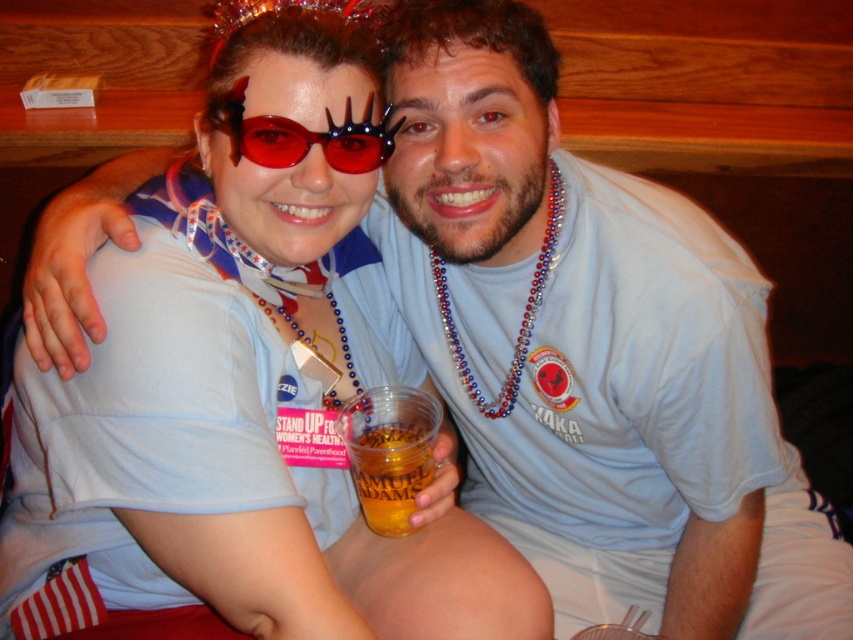
You are at a party and need to choose between the red plastic goggles at center and the translucent plastic cup at lower center to place on your head. Which one is more suitable based on their height?

The red plastic goggles at center has a lesser height compared to the translucent plastic cup at lower center, so the red plastic goggles at center would be more suitable to place on your head since it is shorter and less likely to obstruct your vision.

You are a bartender at a party. You need to serve a drink to the person wearing the red plastic goggles at center. Where should you place the drink relative to the translucent plastic cup at lower center?

The red plastic goggles at center is in front of the translucent plastic cup at lower center, so you should place the drink behind the translucent plastic cup at lower center so it is visible to the person wearing the goggles.

You are a photographer standing at the camera position. You want to take a closeup photo of the point at coordinates point (280, 129). The camera has a focal length of 50mm and a sensor size of 24mm x 36mm. What is the minimum distance you need to move forward or backward to ensure the point is in focus if the depth of field at current position allows focus from 30 to 35 inches?

The point at coordinates point (280, 129) is currently 32.35 inches from the camera, which falls within the depth of field range of 30 to 35 inches. Therefore, no adjustment is needed as the point is already within the focused area.